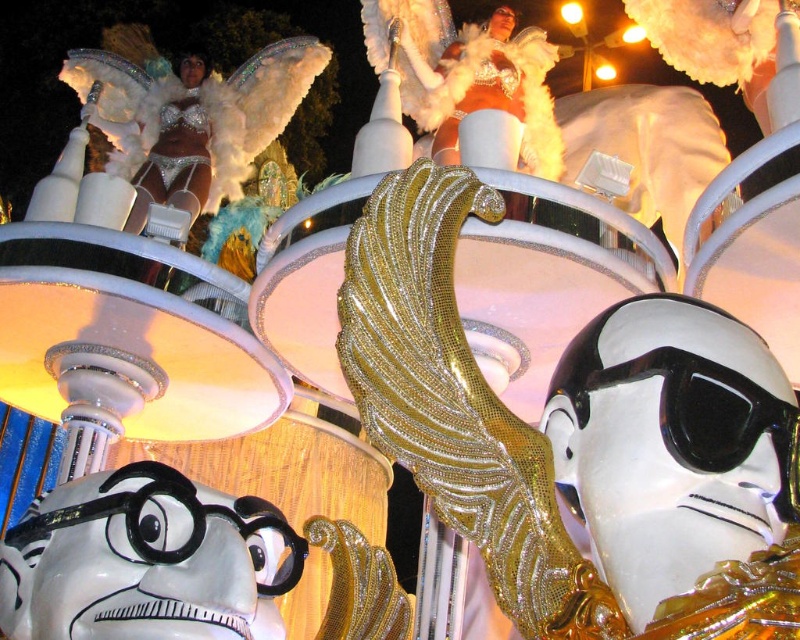
Is gold glittery wing at center above white feather wings at upper left?

Actually, gold glittery wing at center is below white feather wings at upper left.

Is point (649, 636) positioned after point (226, 93)?

No.

This screenshot has height=640, width=800. What are the coordinates of `gold glittery wing at center` in the screenshot? It's located at point(582,440).

Can you confirm if gold glittery wing at center is bigger than black glossy goggles at center?

Yes.

Is point (670, 468) positioned behind point (730, 406)?

No, it is not.

You are a GUI agent. You are given a task and a screenshot of the screen. Output one action in this format:
    pyautogui.click(x=<x>, y=<y>)
    Task: Click on the gold glittery wing at center
    
    Given the screenshot: What is the action you would take?
    pyautogui.click(x=582, y=440)

From the picture: Does white feather wings at upper left have a lesser width compared to black glossy goggles at center?

In fact, white feather wings at upper left might be wider than black glossy goggles at center.

Between white feather wings at upper left and black glossy goggles at center, which one appears on the left side from the viewer's perspective?

Positioned to the left is white feather wings at upper left.

Where is `white feather wings at upper left`? Image resolution: width=800 pixels, height=640 pixels. white feather wings at upper left is located at coordinates (189, 115).